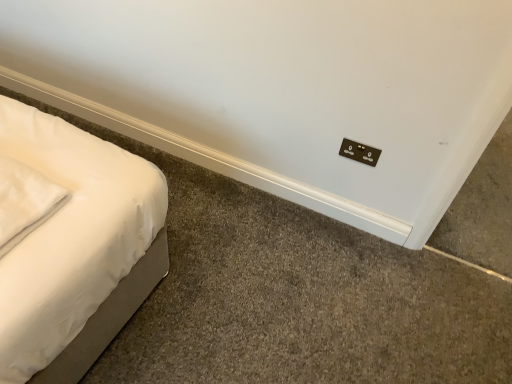
This screenshot has height=384, width=512. Find the location of `brown matte electric outlet at upper right`. brown matte electric outlet at upper right is located at coordinates (359, 152).

Describe the element at coordinates (359, 152) in the screenshot. The height and width of the screenshot is (384, 512). I see `brown matte electric outlet at upper right` at that location.

What is the approximate height of white soft pillow at left?

The height of white soft pillow at left is 3.46 inches.

The height and width of the screenshot is (384, 512). Describe the element at coordinates (25, 201) in the screenshot. I see `white soft pillow at left` at that location.

Where is `white soft pillow at left`? The height and width of the screenshot is (384, 512). white soft pillow at left is located at coordinates (25, 201).

What are the coordinates of `brown matte electric outlet at upper right` in the screenshot? It's located at (359, 152).

Is white soft pillow at left to the left of brown matte electric outlet at upper right from the viewer's perspective?

Correct, you'll find white soft pillow at left to the left of brown matte electric outlet at upper right.

Is white soft pillow at left positioned behind brown matte electric outlet at upper right?

No, white soft pillow at left is in front of brown matte electric outlet at upper right.

Considering the positions of point (50, 212) and point (346, 143), is point (50, 212) closer or farther from the camera than point (346, 143)?

Point (50, 212) is positioned closer to the camera compared to point (346, 143).

Looking at this image, from the image's perspective, is white soft pillow at left located above or below brown matte electric outlet at upper right?

From the image's perspective, white soft pillow at left appears below brown matte electric outlet at upper right.

From a real-world perspective, who is located lower, white soft pillow at left or brown matte electric outlet at upper right?

From a 3D spatial view, brown matte electric outlet at upper right is below.

Is white soft pillow at left thinner than brown matte electric outlet at upper right?

No, white soft pillow at left is not thinner than brown matte electric outlet at upper right.

Considering the sizes of white soft pillow at left and brown matte electric outlet at upper right in the image, is white soft pillow at left taller or shorter than brown matte electric outlet at upper right?

Considering their sizes, white soft pillow at left has less height than brown matte electric outlet at upper right.

Considering the relative sizes of white soft pillow at left and brown matte electric outlet at upper right in the image provided, is white soft pillow at left bigger than brown matte electric outlet at upper right?

Yes.

Which is correct: white soft pillow at left is inside brown matte electric outlet at upper right, or outside of it?

white soft pillow at left is located beyond the bounds of brown matte electric outlet at upper right.

Is white soft pillow at left far away from brown matte electric outlet at upper right?

white soft pillow at left is positioned a significant distance from brown matte electric outlet at upper right.

Does white soft pillow at left turn towards brown matte electric outlet at upper right?

No.

How many degrees apart are the facing directions of white soft pillow at left and brown matte electric outlet at upper right?

They differ by 86.8 degrees in their facing directions.

In the image, there is a white soft pillow at left. Where is `electric outlet above it (from the image's perspective)`? The image size is (512, 384). electric outlet above it (from the image's perspective) is located at coordinates (359, 152).

Is brown matte electric outlet at upper right to the left or to the right of white soft pillow at left in the image?

From the image, it's evident that brown matte electric outlet at upper right is to the right of white soft pillow at left.

In the image, is brown matte electric outlet at upper right positioned in front of or behind white soft pillow at left?

Clearly, brown matte electric outlet at upper right is behind white soft pillow at left.

Considering the points (351, 141) and (54, 211), which point is in front, point (351, 141) or point (54, 211)?

The point (54, 211) is more forward.

From the image's perspective, is brown matte electric outlet at upper right above white soft pillow at left?

Yes, from the image's perspective, brown matte electric outlet at upper right is over white soft pillow at left.

From a real-world perspective, is brown matte electric outlet at upper right located beneath white soft pillow at left?

Yes.

Considering the sizes of objects brown matte electric outlet at upper right and white soft pillow at left in the image provided, who is wider, brown matte electric outlet at upper right or white soft pillow at left?

With larger width is white soft pillow at left.

Considering the sizes of brown matte electric outlet at upper right and white soft pillow at left in the image, is brown matte electric outlet at upper right taller or shorter than white soft pillow at left?

brown matte electric outlet at upper right is taller than white soft pillow at left.

Looking at the image, does brown matte electric outlet at upper right seem bigger or smaller compared to white soft pillow at left?

Considering their sizes, brown matte electric outlet at upper right takes up less space than white soft pillow at left.

Would you say brown matte electric outlet at upper right is outside white soft pillow at left?

Yes, brown matte electric outlet at upper right is not within white soft pillow at left.

Are brown matte electric outlet at upper right and white soft pillow at left beside each other?

No, brown matte electric outlet at upper right is not touching white soft pillow at left.

Looking at this image, is brown matte electric outlet at upper right oriented towards white soft pillow at left?

No.

The width and height of the screenshot is (512, 384). I want to click on electric outlet behind the white soft pillow at left, so click(359, 152).

Where is `pillow on the left of brown matte electric outlet at upper right`? The width and height of the screenshot is (512, 384). pillow on the left of brown matte electric outlet at upper right is located at coordinates (25, 201).

The width and height of the screenshot is (512, 384). Identify the location of electric outlet beneath the white soft pillow at left (from a real-world perspective). (359, 152).